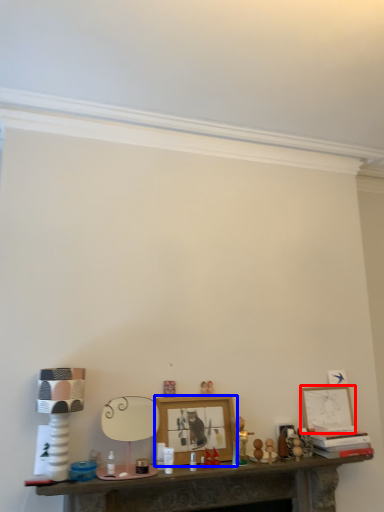
Question: Which of the following is the closest to the observer, picture frame (highlighted by a red box) or picture frame (highlighted by a blue box)?

Choices:
 (A) picture frame
 (B) picture frame

Answer: (B)